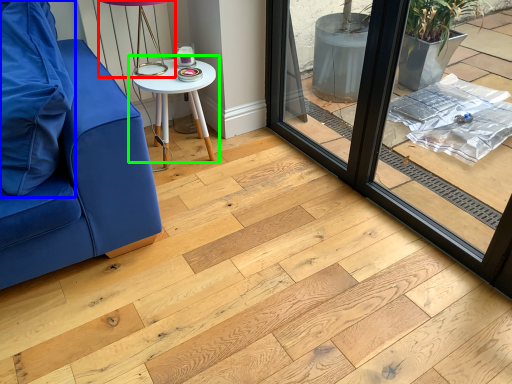
Question: Which object is the closest to the table lamp (highlighted by a red box)? Choose among these: pillow (highlighted by a blue box) or table (highlighted by a green box).

Choices:
 (A) pillow
 (B) table

Answer: (B)